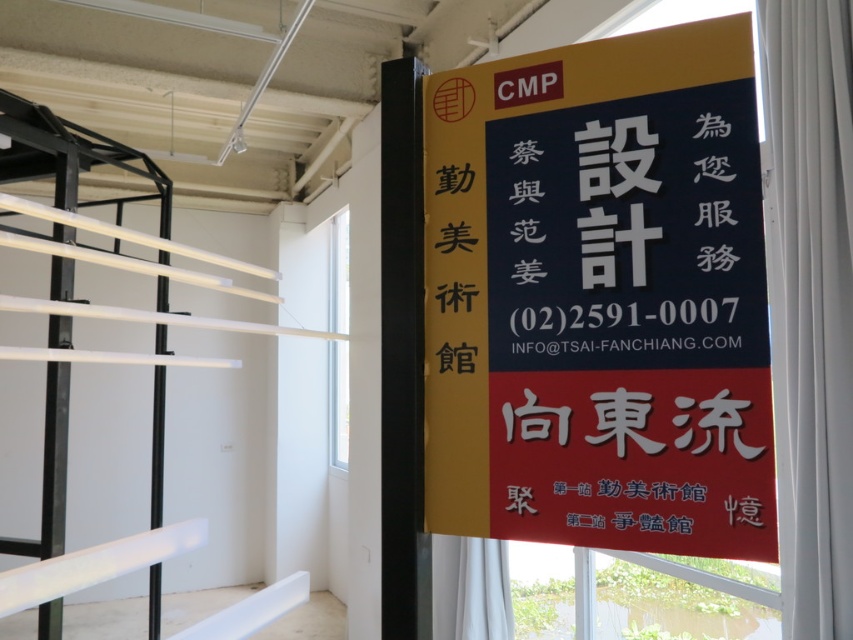
Is white fabric curtain at right positioned at the back of transparent glass window at upper center?

No.

Does white fabric curtain at right have a greater width compared to transparent glass window at upper center?

Yes.

Between point (809, 408) and point (343, 428), which one is positioned behind?

The point (343, 428) is more distant.

The image size is (853, 640). In order to click on white fabric curtain at right in this screenshot , I will do `click(813, 292)`.

Who is lower down, matte black signboard at center or white fabric curtain at right?

matte black signboard at center is lower down.

Which is above, matte black signboard at center or white fabric curtain at right?

white fabric curtain at right is higher up.

The height and width of the screenshot is (640, 853). I want to click on matte black signboard at center, so pos(599,298).

You are a GUI agent. You are given a task and a screenshot of the screen. Output one action in this format:
    pyautogui.click(x=<x>, y=<y>)
    Task: Click on the matte black signboard at center
    The width and height of the screenshot is (853, 640).
    Given the screenshot: What is the action you would take?
    pyautogui.click(x=599, y=298)

Is matte black signboard at center positioned behind transparent glass window at upper center?

No.

Who is more forward, [697,29] or [335,372]?

Point [697,29] is in front.

Locate an element on the screen. The height and width of the screenshot is (640, 853). matte black signboard at center is located at coordinates (599, 298).